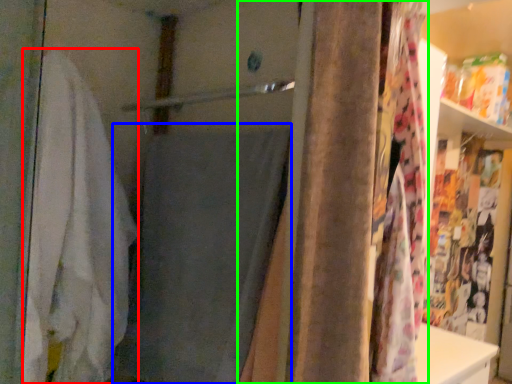
Question: Which object is positioned closest to bath towel (highlighted by a red box)? Select from bath towel (highlighted by a blue box) and curtain (highlighted by a green box).

Choices:
 (A) bath towel
 (B) curtain

Answer: (A)